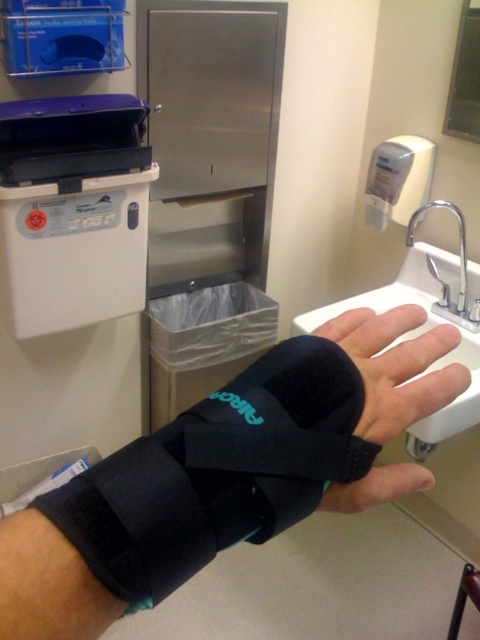
Question: From the image, what is the correct spatial relationship of black neoprene wristband at center in relation to silver metallic faucet at upper right?

Choices:
 (A) right
 (B) left

Answer: (B)

Question: Is black neoprene wrist brace at center above silver metallic faucet at upper right?

Choices:
 (A) yes
 (B) no

Answer: (B)

Question: Which object is closer to the camera taking this photo?

Choices:
 (A) white ceramic sink at center
 (B) black neoprene wrist brace at center
 (C) matte gray plastic hand dryer at upper right
 (D) black neoprene wristband at center

Answer: (D)

Question: Among these points, which one is nearest to the camera?

Choices:
 (A) (x=409, y=157)
 (B) (x=462, y=291)
 (C) (x=410, y=333)

Answer: (C)

Question: Which point is closer to the camera?

Choices:
 (A) (445, 292)
 (B) (87, 481)
 (C) (411, 406)
 (D) (424, 289)

Answer: (B)

Question: Is black neoprene wristband at center above silver metallic faucet at upper right?

Choices:
 (A) no
 (B) yes

Answer: (A)